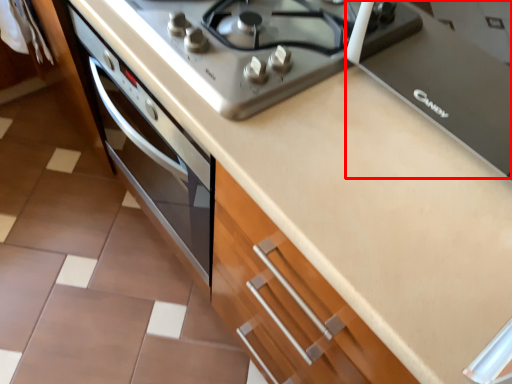
Question: Where is appliance (annotated by the red box) located in relation to gas stove in the image?

Choices:
 (A) right
 (B) left

Answer: (A)